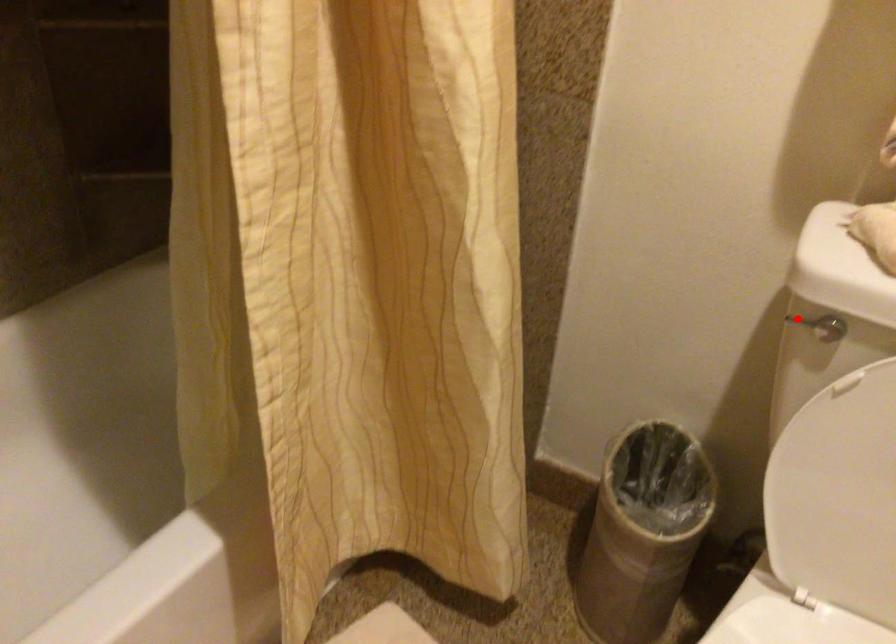
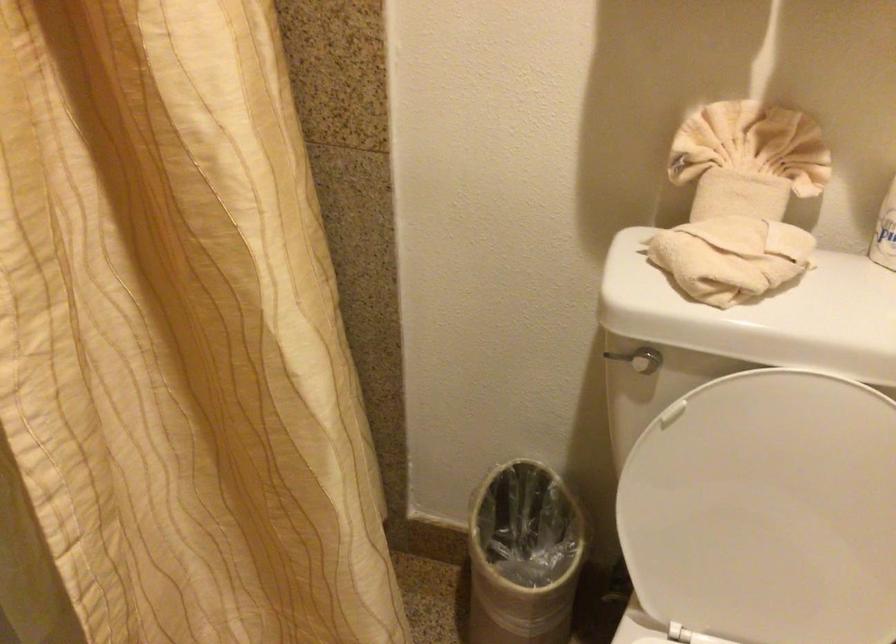
Where in the second image is the point corresponding to the highlighted location from the first image?

(616, 357)